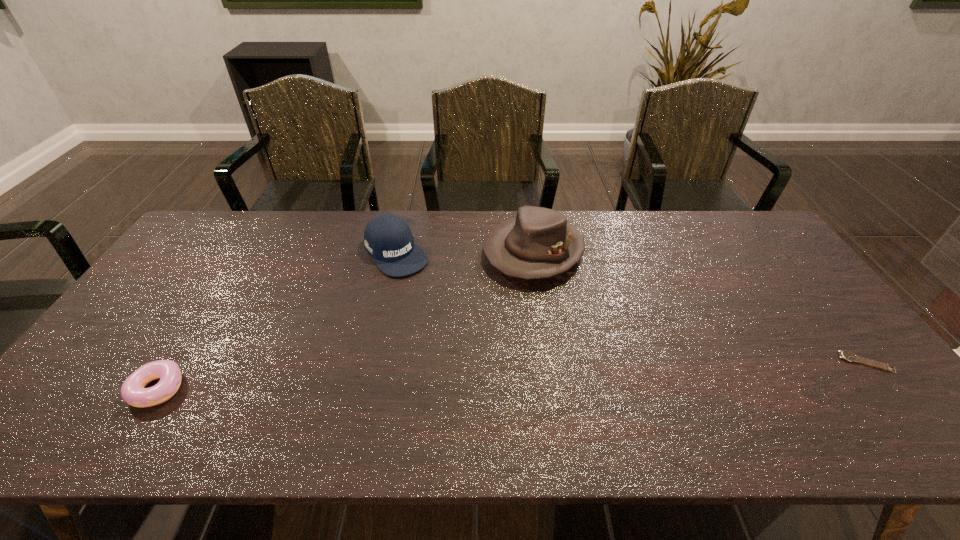
The height and width of the screenshot is (540, 960). What are the coordinates of `the leftmost object` in the screenshot? It's located at (133, 392).

Where is `the second shortest object`? the second shortest object is located at coordinates (133, 392).

At what (x,y) coordinates should I click in order to perform the action: click on the rightmost object. Please return your answer as a coordinate pair (x, y). The image size is (960, 540). Looking at the image, I should click on (846, 355).

Where is `watch`? watch is located at coordinates (846, 355).

This screenshot has width=960, height=540. In order to click on hat in this screenshot , I will do `click(538, 243)`.

Where is `the tallest object`? The width and height of the screenshot is (960, 540). the tallest object is located at coordinates (538, 243).

At what (x,y) coordinates should I click in order to perform the action: click on the second object from left to right. Please return your answer as a coordinate pair (x, y). Looking at the image, I should click on (388, 239).

The width and height of the screenshot is (960, 540). I want to click on baseball cap, so click(388, 239).

I want to click on vacant space located on the back of the leftmost object, so click(x=230, y=274).

You are a GUI agent. You are given a task and a screenshot of the screen. Output one action in this format:
    pyautogui.click(x=<x>, y=<y>)
    Task: Click on the free spot located on the back of the rightmost object
    This screenshot has height=540, width=960.
    Given the screenshot: What is the action you would take?
    pyautogui.click(x=836, y=326)